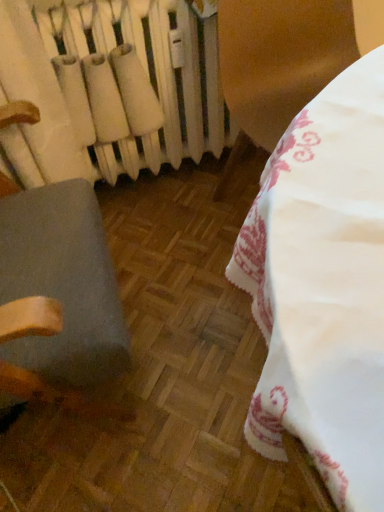
Question: Considering the positions of gray fabric chair at left and white matte radiator at upper left in the image, is gray fabric chair at left bigger or smaller than white matte radiator at upper left?

Choices:
 (A) big
 (B) small

Answer: (A)

Question: Is gray fabric chair at left wider or thinner than white matte radiator at upper left?

Choices:
 (A) thin
 (B) wide

Answer: (B)

Question: From the image's perspective, is gray fabric chair at left above or below white matte radiator at upper left?

Choices:
 (A) below
 (B) above

Answer: (A)

Question: From a real-world perspective, is white matte radiator at upper left positioned above or below gray fabric chair at left?

Choices:
 (A) above
 (B) below

Answer: (B)

Question: Visually, is white matte radiator at upper left positioned to the left or to the right of gray fabric chair at left?

Choices:
 (A) left
 (B) right

Answer: (B)

Question: Is white matte radiator at upper left in front of or behind gray fabric chair at left in the image?

Choices:
 (A) front
 (B) behind

Answer: (B)

Question: Considering the positions of white matte radiator at upper left and gray fabric chair at left in the image, is white matte radiator at upper left wider or thinner than gray fabric chair at left?

Choices:
 (A) thin
 (B) wide

Answer: (A)